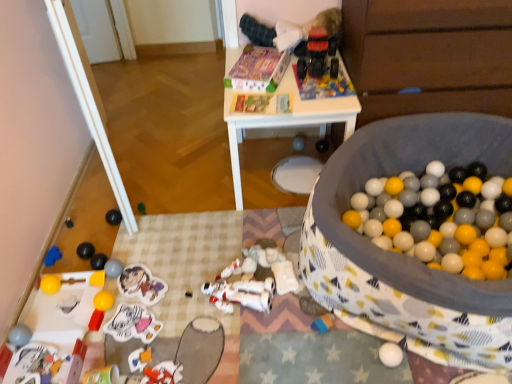
Where is `vacant space in front of matte white sticker at center, the fourteenth toy when ordered from left to right`? The height and width of the screenshot is (384, 512). vacant space in front of matte white sticker at center, the fourteenth toy when ordered from left to right is located at coordinates (131, 364).